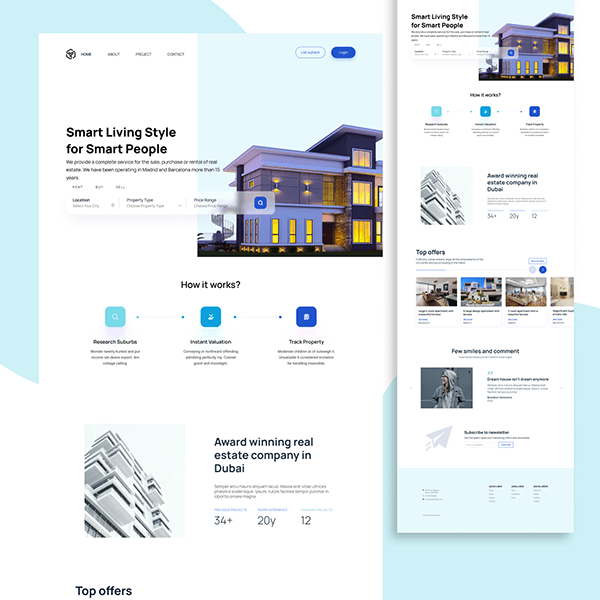
I want to click on wall, so click(467, 381).